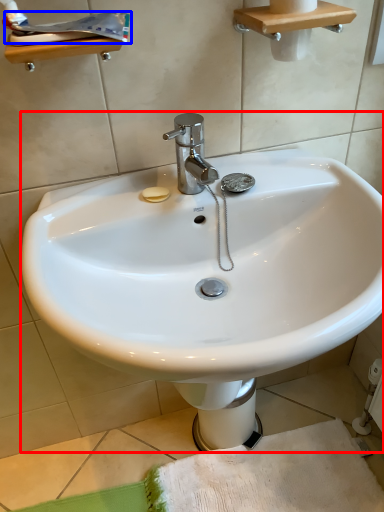
Question: Which of the following is the farthest to the observer, sink (highlighted by a red box) or toothpaste (highlighted by a blue box)?

Choices:
 (A) sink
 (B) toothpaste

Answer: (B)